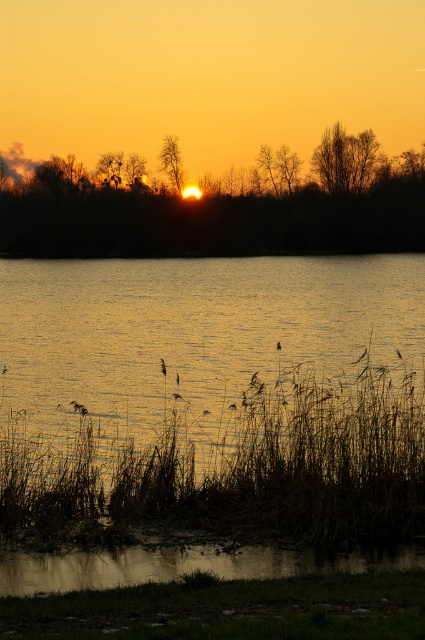
Question: Does brown grass at lower center appear under brown feathered bird at center?

Choices:
 (A) no
 (B) yes

Answer: (B)

Question: Which point is farther from the camera taking this photo?

Choices:
 (A) (277, 349)
 (B) (42, 509)

Answer: (A)

Question: Does brown grass at lower center appear on the left side of brown feathered bird at center?

Choices:
 (A) yes
 (B) no

Answer: (B)

Question: In this image, where is brown grass at lower center located relative to brown feathered bird at center?

Choices:
 (A) below
 (B) above

Answer: (A)

Question: Which point appears closest to the camera in this image?

Choices:
 (A) (112, 483)
 (B) (277, 349)

Answer: (A)